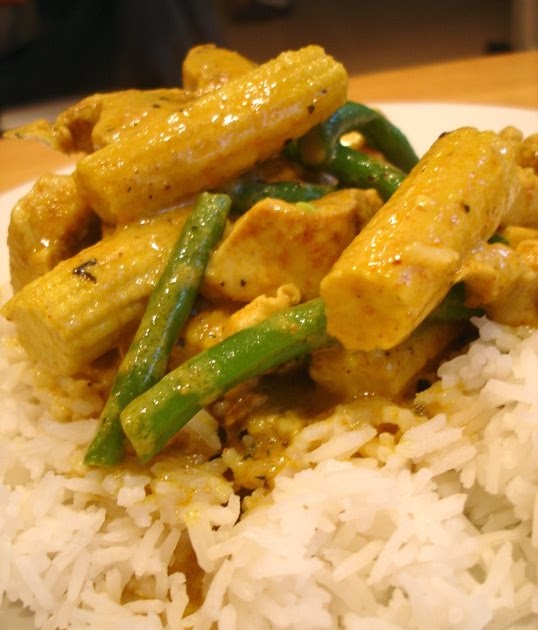
Locate an element on the screen. rim of plate is located at coordinates (481, 106).